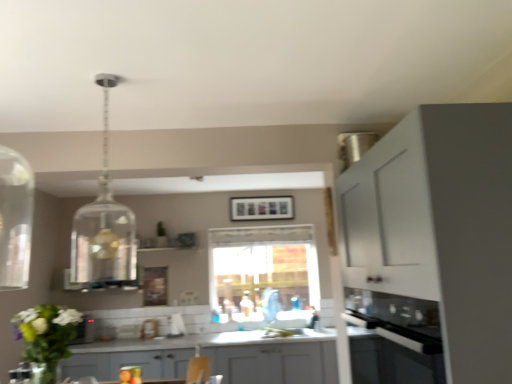
Find the location of a particular element. blank space above clear glass pendant light at upper center (from a real-world perspective) is located at coordinates (106, 75).